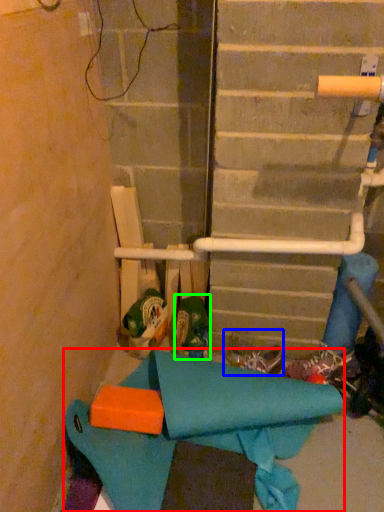
Question: Based on their relative distances, which object is farther from fabric (highlighted by a red box)? Choose from footwear (highlighted by a blue box) and footwear (highlighted by a green box).

Choices:
 (A) footwear
 (B) footwear

Answer: (A)